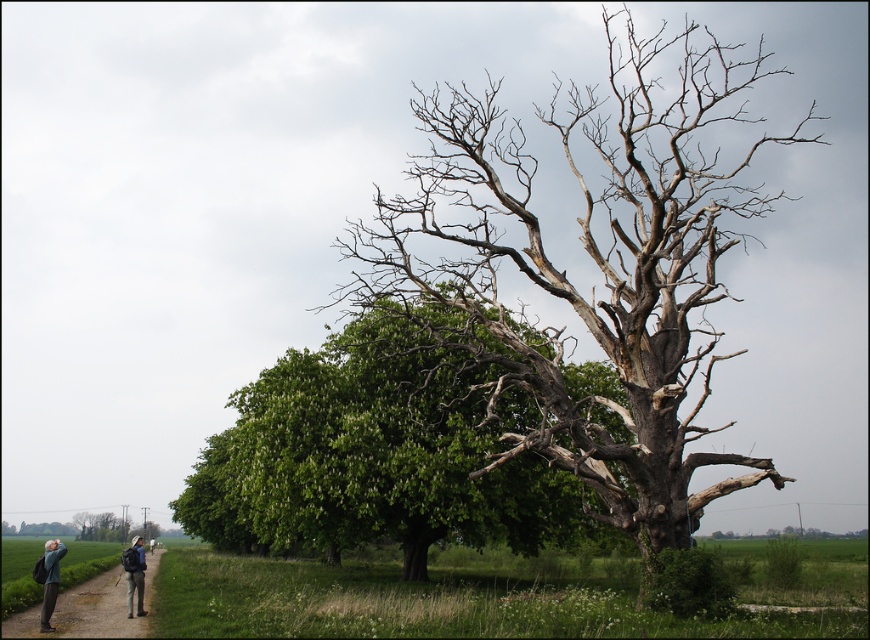
You are an outdoor adventurer carrying a dark blue backpack at lower left and want to reach the bare wood tree at center. Given that your maximum walking distance is 25 meters, can you reach the tree without exceeding your limit?

The bare wood tree at center is 24.92 meters away from dark blue backpack at lower left. Since 24.92 meters is less than 25 meters, you can reach the tree without exceeding your limit.

You are standing at the point with coordinates point (653,221) and want to walk towards the point (121,556). Which direction should you face to move towards your destination?

You should face the direction towards point (121,556), which is behind point (653,221) based on their spatial relationship.

You are a botanist examining the rural landscape described. You notice a point at coordinates (593, 264). Which tree, the large gnarled tree on the right or the smaller healthy tree on the left, is located nearest to this point?

The bare wood tree at center is located nearest to the point (593, 264).